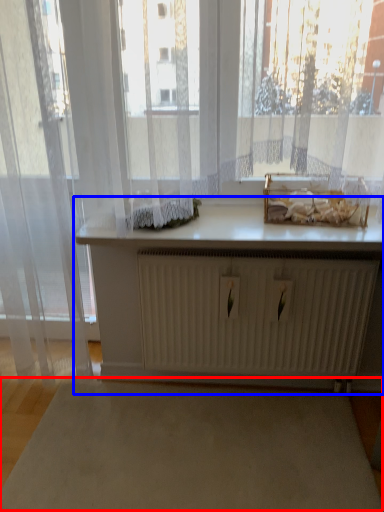
Question: Which object is closer to the camera taking this photo, plain (highlighted by a red box) or table (highlighted by a blue box)?

Choices:
 (A) plain
 (B) table

Answer: (A)